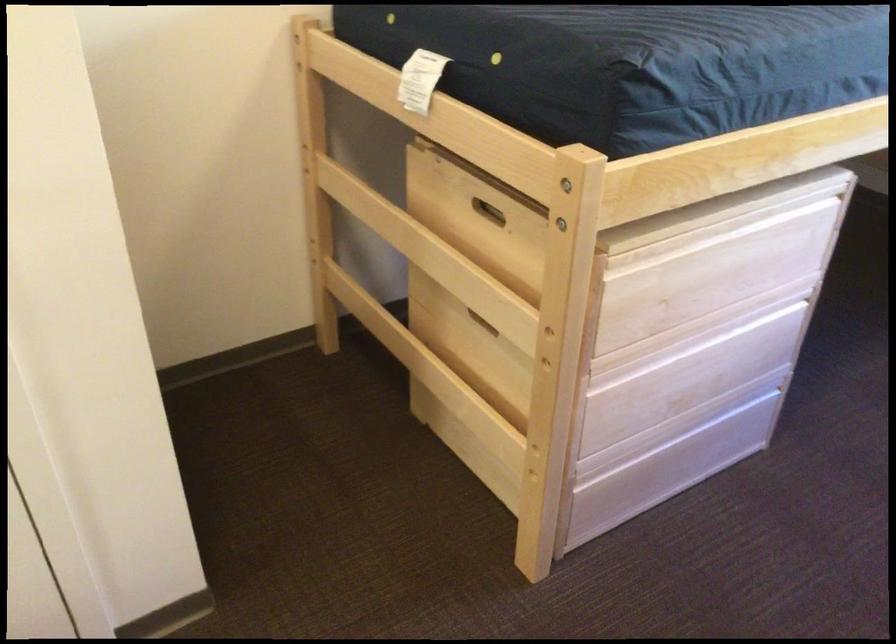
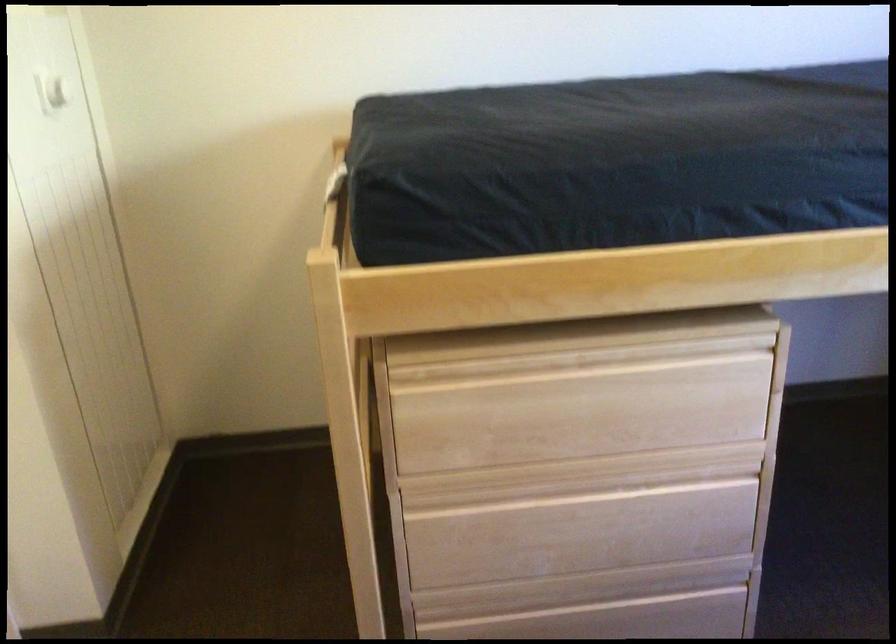
The point at (698, 442) is marked in the first image. Where is the corresponding point in the second image?

(615, 619)